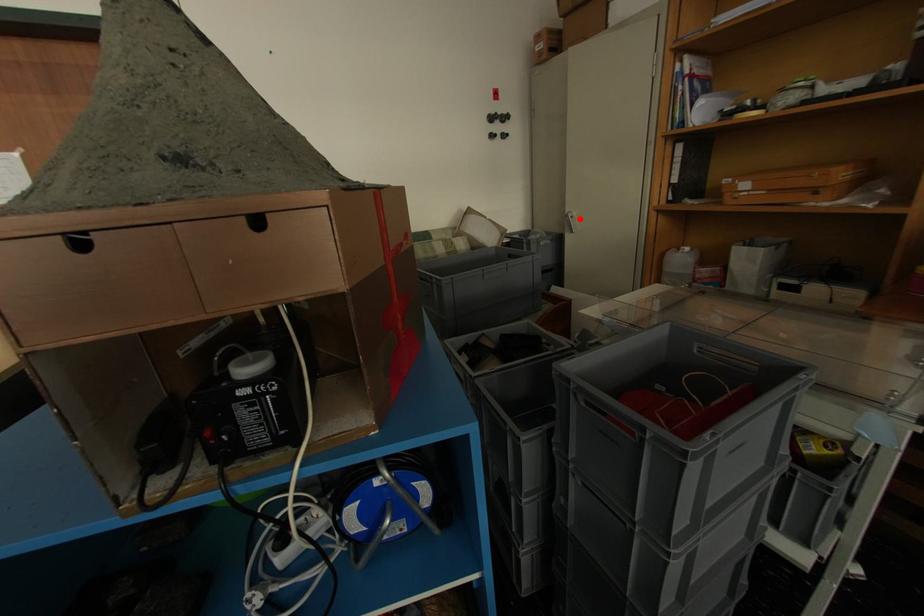
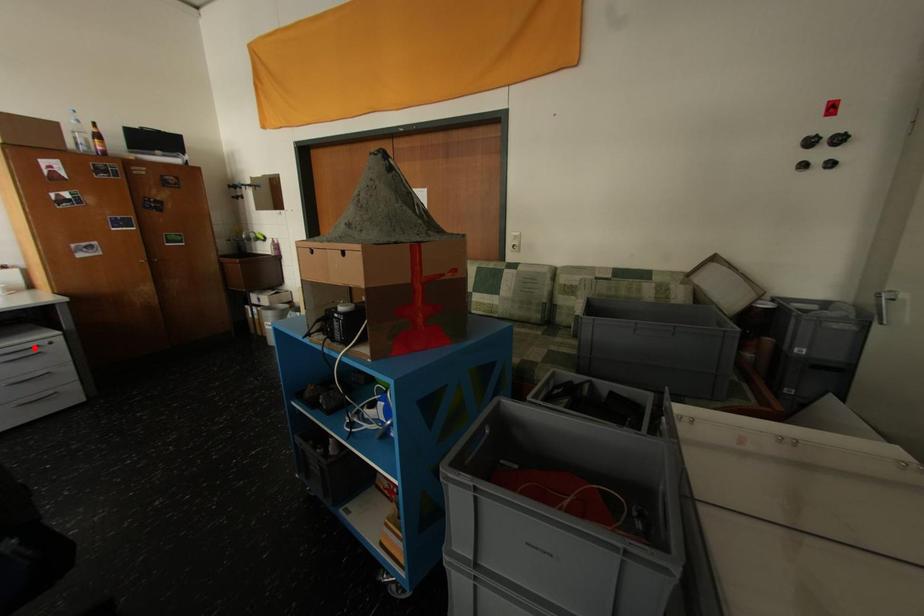
I am providing you with two images of the same scene from different viewpoints. A red point is marked on the first image and another point is marked on the second image. Do the highlighted points in image1 and image2 indicate the same real-world spot?

No